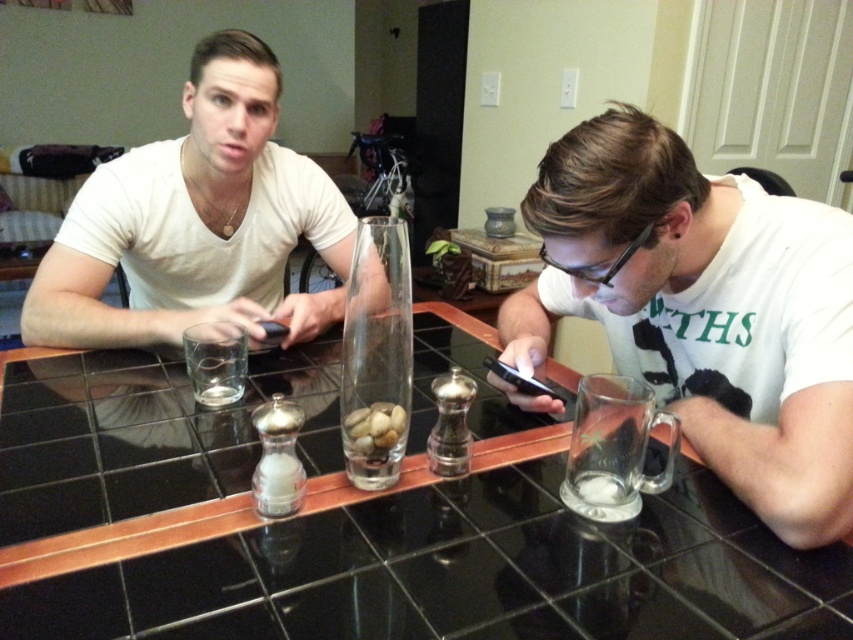
Question: Which object is positioned farthest from the white matte shirt at upper left?

Choices:
 (A) clear glass mug at right
 (B) black glass table at center

Answer: (A)

Question: Which point is farther to the camera?

Choices:
 (A) white matte shirt at upper left
 (B) clear glass mug at right

Answer: (A)

Question: Which is farther from the black glass table at center?

Choices:
 (A) clear glass mug at right
 (B) white matte shirt at upper left

Answer: (B)

Question: Can you confirm if black glass table at center is positioned to the left of white matte shirt at upper left?

Choices:
 (A) yes
 (B) no

Answer: (B)

Question: Can you confirm if black glass table at center is positioned to the left of clear glass mug at right?

Choices:
 (A) no
 (B) yes

Answer: (B)

Question: Is black glass table at center smaller than white matte shirt at upper left?

Choices:
 (A) no
 (B) yes

Answer: (A)